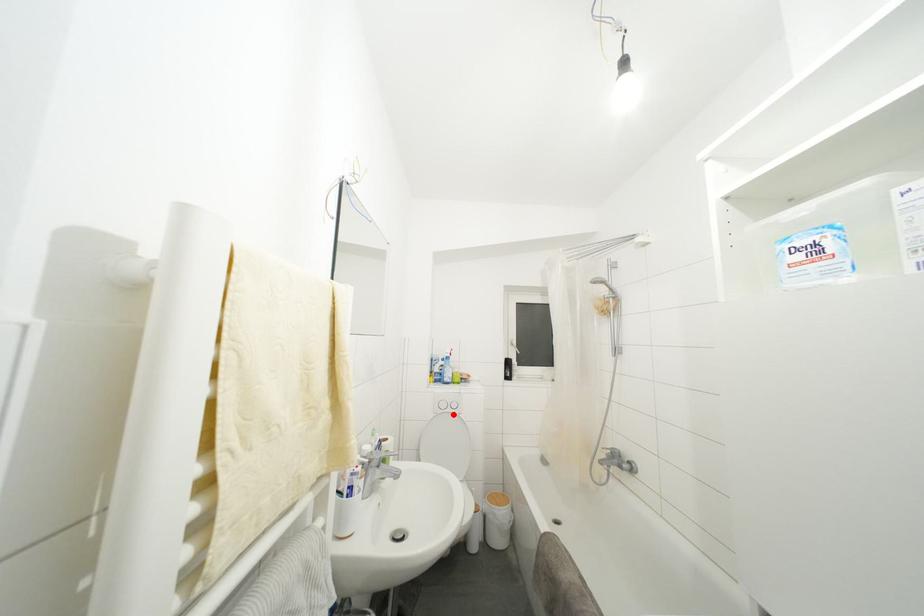
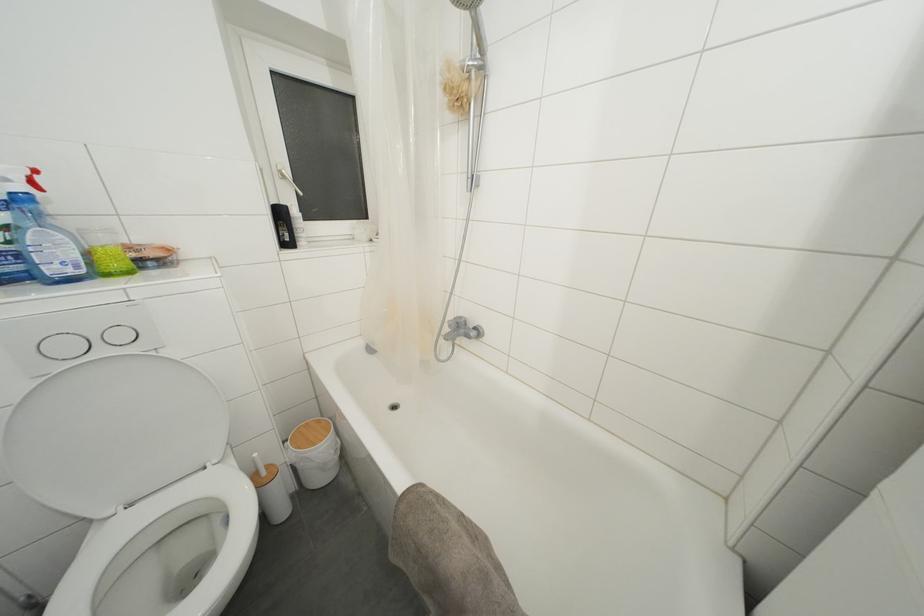
The point at the highlighted location is marked in the first image. Where is the corresponding point in the second image?

(106, 357)